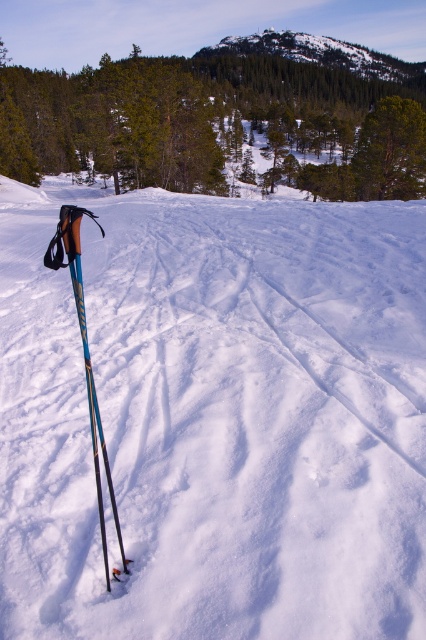
Question: Estimate the real-world distances between objects in this image. Which object is farther from the white fluffy snow at center?

Choices:
 (A) snowy rocky hill at upper center
 (B) blue metallic ski pole at left

Answer: (A)

Question: Among these objects, which one is farthest from the camera?

Choices:
 (A) white fluffy snow at center
 (B) snowy rocky hill at upper center
 (C) blue metallic ski pole at left

Answer: (B)

Question: Considering the relative positions of white fluffy snow at center and blue metallic ski pole at left in the image provided, where is white fluffy snow at center located with respect to blue metallic ski pole at left?

Choices:
 (A) left
 (B) right

Answer: (B)

Question: Can you confirm if snowy rocky hill at upper center is bigger than blue metallic ski pole at left?

Choices:
 (A) yes
 (B) no

Answer: (A)

Question: Is white fluffy snow at center thinner than blue metallic ski pole at left?

Choices:
 (A) yes
 (B) no

Answer: (B)

Question: Which point is closer to the camera taking this photo?

Choices:
 (A) (103, 536)
 (B) (416, 609)
 (C) (275, 33)

Answer: (B)